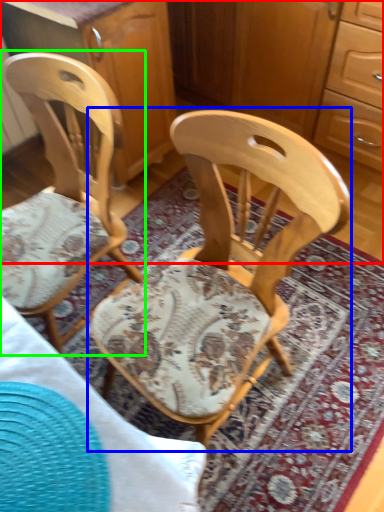
Question: Estimate the real-world distances between objects in this image. Which object is farther from dresser (highlighted by a red box), chair (highlighted by a blue box) or chair (highlighted by a green box)?

Choices:
 (A) chair
 (B) chair

Answer: (B)